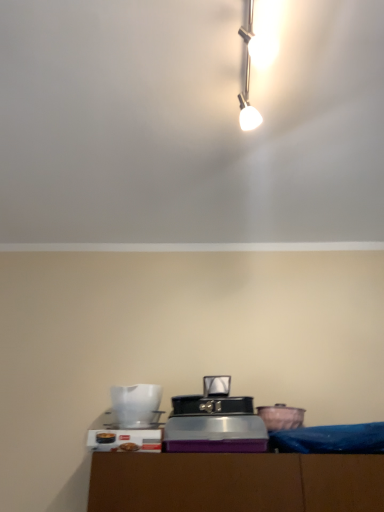
Question: Is matte pink ceramic bowl at lower right, which is the third appliance in left-to-right order, facing towards white glossy pitcher at lower left, the second appliance from the right?

Choices:
 (A) no
 (B) yes

Answer: (A)

Question: From a real-world perspective, is matte pink ceramic bowl at lower right, acting as the 1th appliance starting from the right, located beneath white glossy pitcher at lower left, the second appliance from the right?

Choices:
 (A) no
 (B) yes

Answer: (B)

Question: Can you confirm if matte pink ceramic bowl at lower right, acting as the 1th appliance starting from the right, is thinner than white glossy pitcher at lower left, the second appliance from the right?

Choices:
 (A) no
 (B) yes

Answer: (B)

Question: From the image's perspective, is matte pink ceramic bowl at lower right, which is the third appliance in left-to-right order, over white glossy pitcher at lower left, arranged as the 2th appliance when viewed from the left?

Choices:
 (A) no
 (B) yes

Answer: (A)

Question: Considering the relative sizes of matte pink ceramic bowl at lower right, acting as the 1th appliance starting from the right, and white glossy pitcher at lower left, arranged as the 2th appliance when viewed from the left, in the image provided, is matte pink ceramic bowl at lower right, acting as the 1th appliance starting from the right, shorter than white glossy pitcher at lower left, arranged as the 2th appliance when viewed from the left,?

Choices:
 (A) no
 (B) yes

Answer: (B)

Question: Is white glossy pitcher at lower left, the second appliance from the right, at the back of matte pink ceramic bowl at lower right, which is the third appliance in left-to-right order?

Choices:
 (A) yes
 (B) no

Answer: (B)

Question: Is matte pink ceramic bowl at lower right, which is the third appliance in left-to-right order, behind white plastic toaster at lower center, which appears as the 1th appliance when viewed from the left?

Choices:
 (A) no
 (B) yes

Answer: (B)

Question: Considering the relative sizes of matte pink ceramic bowl at lower right, acting as the 1th appliance starting from the right, and white plastic toaster at lower center, which appears as the 1th appliance when viewed from the left, in the image provided, is matte pink ceramic bowl at lower right, acting as the 1th appliance starting from the right, shorter than white plastic toaster at lower center, which appears as the 1th appliance when viewed from the left,?

Choices:
 (A) yes
 (B) no

Answer: (A)

Question: Does matte pink ceramic bowl at lower right, acting as the 1th appliance starting from the right, have a greater width compared to white plastic toaster at lower center, which appears as the 1th appliance when viewed from the left?

Choices:
 (A) no
 (B) yes

Answer: (A)

Question: Is matte pink ceramic bowl at lower right, acting as the 1th appliance starting from the right, not inside white plastic toaster at lower center, which appears as the 1th appliance when viewed from the left?

Choices:
 (A) yes
 (B) no

Answer: (A)

Question: Does matte pink ceramic bowl at lower right, acting as the 1th appliance starting from the right, have a larger size compared to white plastic toaster at lower center, marked as the third appliance in a right-to-left arrangement?

Choices:
 (A) yes
 (B) no

Answer: (B)

Question: Is matte pink ceramic bowl at lower right, acting as the 1th appliance starting from the right, touching white plastic toaster at lower center, marked as the third appliance in a right-to-left arrangement?

Choices:
 (A) no
 (B) yes

Answer: (A)

Question: Is white plastic toaster at lower center, marked as the third appliance in a right-to-left arrangement, oriented towards white glossy pitcher at lower left, arranged as the 2th appliance when viewed from the left?

Choices:
 (A) yes
 (B) no

Answer: (B)